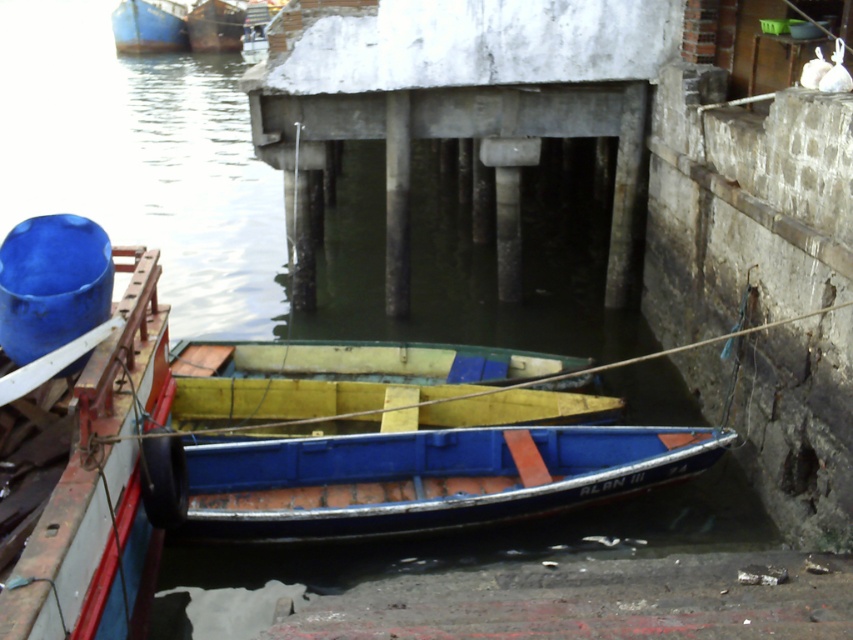
Does smooth blue boat at left have a greater width compared to yellow matte canoe at center?

In fact, smooth blue boat at left might be narrower than yellow matte canoe at center.

Does smooth blue boat at left have a larger size compared to yellow matte canoe at center?

Correct, smooth blue boat at left is larger in size than yellow matte canoe at center.

The image size is (853, 640). I want to click on smooth blue boat at left, so click(78, 433).

Identify the location of smooth blue boat at left. (78, 433).

Which is behind, point (329, 499) or point (477, 371)?

The point (477, 371) is more distant.

Which of these two, blue painted wood canoe at center or yellow matte canoe at center, stands taller?

Standing taller between the two is blue painted wood canoe at center.

Who is more forward, (x=628, y=468) or (x=194, y=358)?

Point (x=628, y=468)

What are the coordinates of `blue painted wood canoe at center` in the screenshot? It's located at (425, 477).

Can you confirm if smooth blue boat at left is bigger than yellow matte wood canoe at center?

Yes, smooth blue boat at left is bigger than yellow matte wood canoe at center.

At what (x,y) coordinates should I click in order to perform the action: click on smooth blue boat at left. Please return your answer as a coordinate pair (x, y). Looking at the image, I should click on (78, 433).